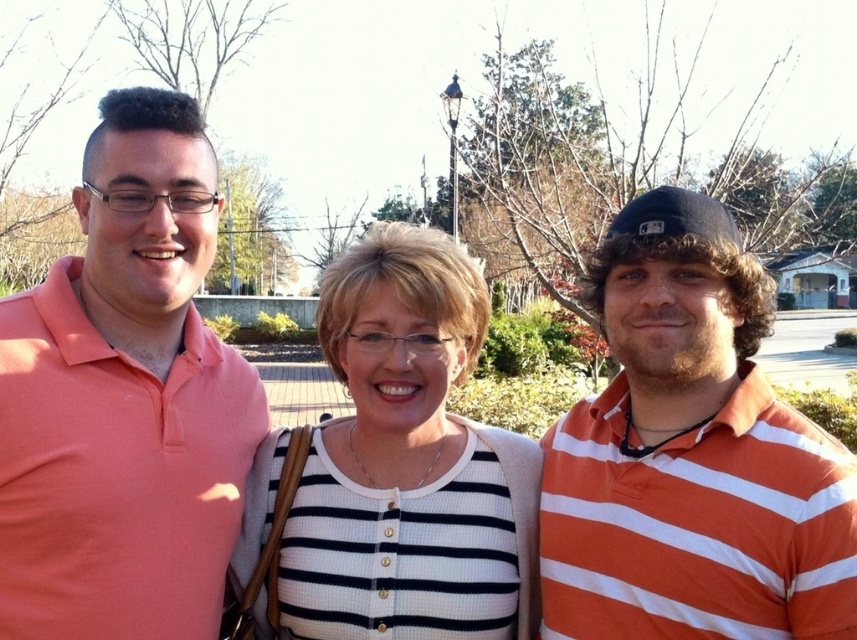
Question: Can you confirm if matte coral polo shirt at left is thinner than white striped sweater at center?

Choices:
 (A) yes
 (B) no

Answer: (A)

Question: From the image, what is the correct spatial relationship of orange striped polo shirt at right in relation to white striped sweater at center?

Choices:
 (A) below
 (B) above

Answer: (A)

Question: Which is farther from the orange striped polo shirt at right?

Choices:
 (A) white striped sweater at center
 (B) matte coral polo shirt at left

Answer: (B)

Question: Can you confirm if orange striped polo shirt at right is wider than white striped sweater at center?

Choices:
 (A) yes
 (B) no

Answer: (B)

Question: Which of the following is the farthest from the observer?

Choices:
 (A) orange striped polo shirt at right
 (B) white striped sweater at center

Answer: (B)

Question: Which object is the closest to the white striped sweater at center?

Choices:
 (A) matte coral polo shirt at left
 (B) orange striped polo shirt at right

Answer: (A)